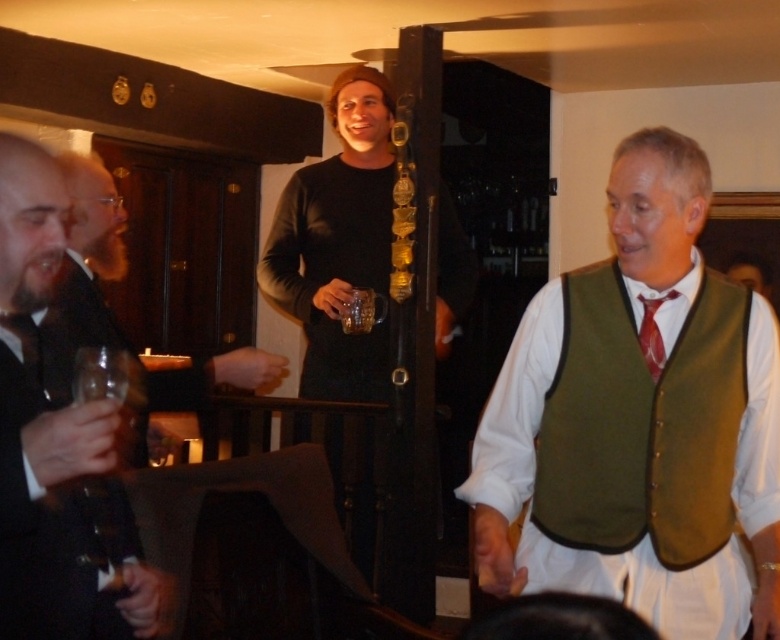
Question: Is green fabric vest at center above matte black shirt at upper center?

Choices:
 (A) yes
 (B) no

Answer: (B)

Question: Observing the image, what is the correct spatial positioning of green fabric vest at right in reference to black matte shirt at upper center?

Choices:
 (A) below
 (B) above

Answer: (A)

Question: Is matte black shirt at upper center smaller than red satin tie at right?

Choices:
 (A) no
 (B) yes

Answer: (A)

Question: Which object is farther from the camera taking this photo?

Choices:
 (A) black matte shirt at upper center
 (B) green fabric vest at center

Answer: (A)

Question: Which of these objects is positioned farthest from the translucent glass at center?

Choices:
 (A) red satin tie at right
 (B) green fabric vest at center
 (C) green fabric vest at right
 (D) black suit at left

Answer: (D)

Question: Estimate the real-world distances between objects in this image. Which object is closer to the black suit at left?

Choices:
 (A) matte black shirt at upper center
 (B) green fabric vest at right
 (C) red satin tie at right
 (D) green fabric vest at center

Answer: (A)